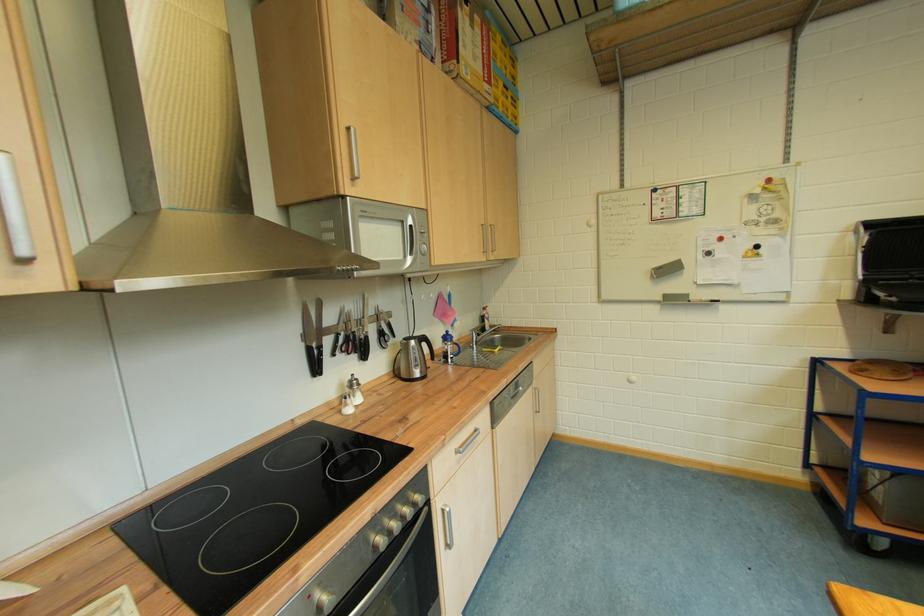
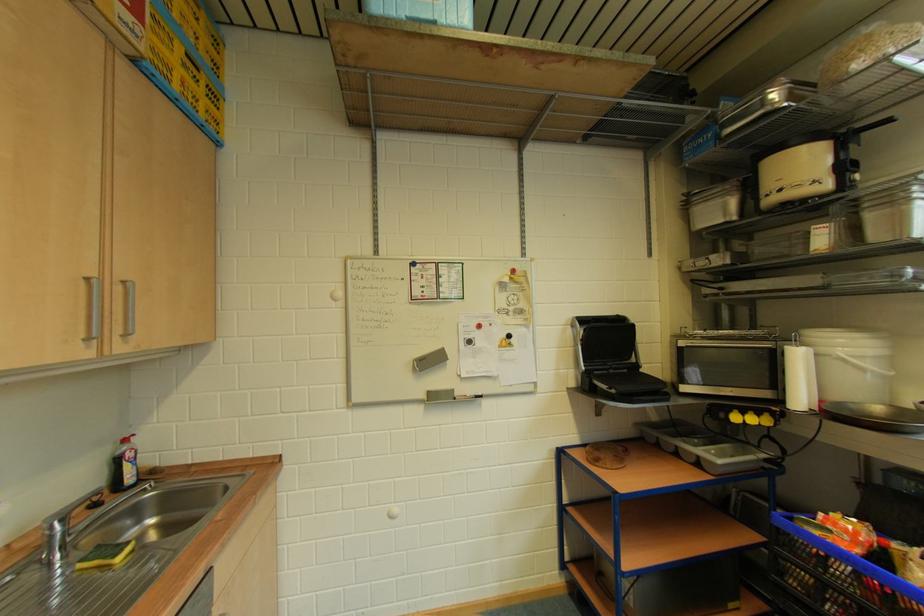
Where in the second image is the point corresponding to the point at 499,103 from the first image?

(150, 50)